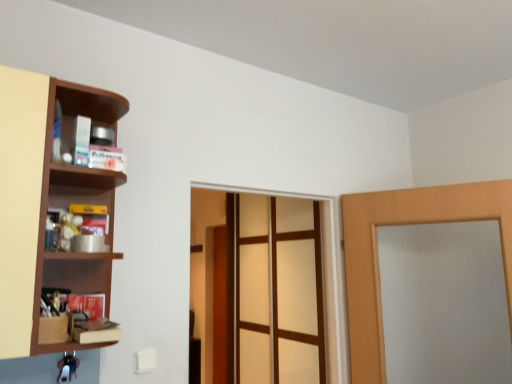
Question: Are light brown wooden door at right, acting as the second door starting from the back, and brown wooden shelf at left beside each other?

Choices:
 (A) no
 (B) yes

Answer: (A)

Question: From the image's perspective, would you say light brown wooden door at right, positioned as the 2th door in left-to-right order, is shown under brown wooden shelf at left?

Choices:
 (A) yes
 (B) no

Answer: (A)

Question: Does light brown wooden door at right, the first door viewed from the right, lie behind brown wooden shelf at left?

Choices:
 (A) yes
 (B) no

Answer: (A)

Question: Is light brown wooden door at right, which is the 1th door in front-to-back order, outside brown wooden shelf at left?

Choices:
 (A) no
 (B) yes

Answer: (B)

Question: Does light brown wooden door at right, which is the 1th door in front-to-back order, have a smaller size compared to brown wooden shelf at left?

Choices:
 (A) no
 (B) yes

Answer: (A)

Question: Can you confirm if light brown wooden door at right, the first door viewed from the right, is wider than brown wooden shelf at left?

Choices:
 (A) no
 (B) yes

Answer: (A)

Question: Can you see wooden door at center, the 2th door viewed from the right, touching brown wooden shelf at left?

Choices:
 (A) no
 (B) yes

Answer: (A)

Question: From a real-world perspective, is wooden door at center, which is counted as the 2th door, starting from the front, beneath brown wooden shelf at left?

Choices:
 (A) no
 (B) yes

Answer: (B)

Question: Is wooden door at center, which is counted as the 2th door, starting from the front, at the left side of brown wooden shelf at left?

Choices:
 (A) yes
 (B) no

Answer: (B)

Question: Is wooden door at center, the 1th door from the left, aimed at brown wooden shelf at left?

Choices:
 (A) no
 (B) yes

Answer: (A)

Question: From the image's perspective, is wooden door at center, the 2th door viewed from the right, above brown wooden shelf at left?

Choices:
 (A) no
 (B) yes

Answer: (A)

Question: Is the position of wooden door at center, which is counted as the 2th door, starting from the front, less distant than that of brown wooden shelf at left?

Choices:
 (A) yes
 (B) no

Answer: (B)

Question: Is translucent glass screen door at center positioned far away from brown wooden shelf at left?

Choices:
 (A) yes
 (B) no

Answer: (A)